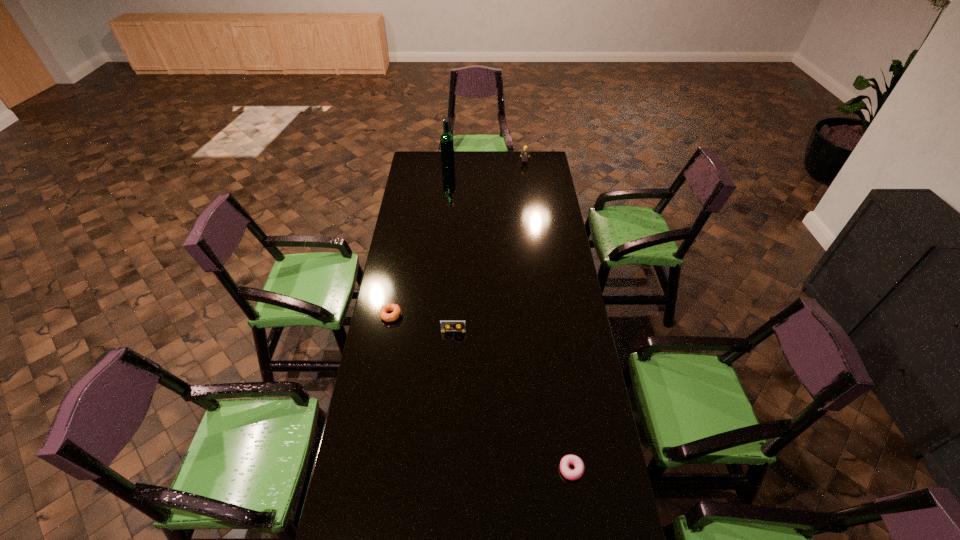
You are a GUI agent. You are given a task and a screenshot of the screen. Output one action in this format:
    pyautogui.click(x=<x>, y=<y>)
    Task: Click on the object identified as the third closest to the fourth shortest object
    The image size is (960, 540).
    Given the screenshot: What is the action you would take?
    pyautogui.click(x=458, y=326)

Locate an element on the screen. object that stands as the second closest to the Lego is located at coordinates (383, 312).

Where is `doughnut identified as the second closest to the tallest object`? doughnut identified as the second closest to the tallest object is located at coordinates (566, 461).

At what (x,y) coordinates should I click in order to perform the action: click on doughnut that is the closest to the Lego. Please return your answer as a coordinate pair (x, y). The height and width of the screenshot is (540, 960). Looking at the image, I should click on (383, 312).

The image size is (960, 540). What are the coordinates of `vacant position in the image that satisfies the following two spatial constraints: 1. at the front of the shortest object with visible reels; 2. on the right side of the videotape` in the screenshot? It's located at (446, 469).

Identify the location of free location that satisfies the following two spatial constraints: 1. in front of the second tallest object; 2. on the left side of the shortest object. (565, 469).